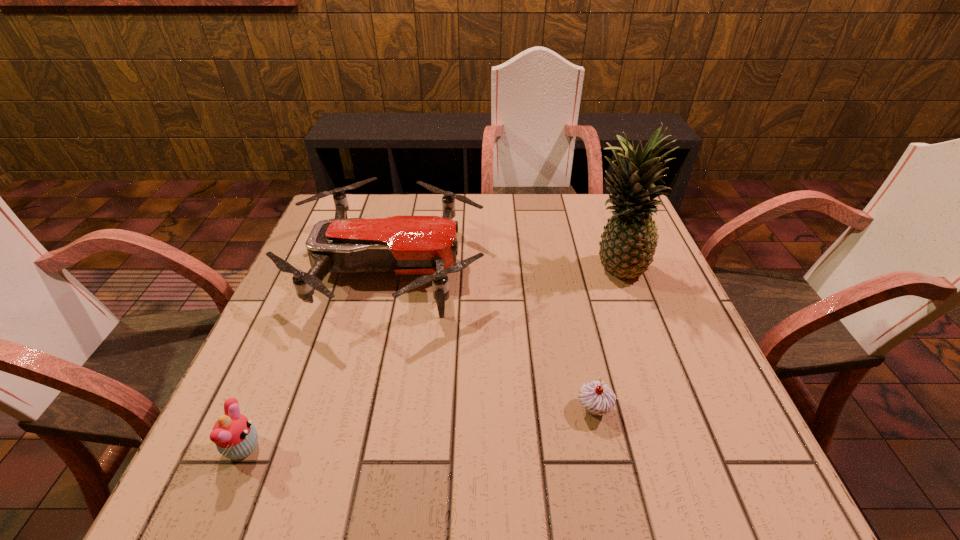
The width and height of the screenshot is (960, 540). I want to click on pineapple, so click(x=628, y=243).

At what (x,y) coordinates should I click in order to perform the action: click on the tallest object. Please return your answer as a coordinate pair (x, y). Looking at the image, I should click on (628, 243).

The height and width of the screenshot is (540, 960). Find the location of `drone`. drone is located at coordinates (403, 245).

Where is `the right cupcake`? the right cupcake is located at coordinates (597, 398).

Locate an element on the screen. This screenshot has height=540, width=960. the left cupcake is located at coordinates (235, 436).

This screenshot has height=540, width=960. I want to click on free space located 0.140m on the front of the rightmost object, so click(x=638, y=330).

This screenshot has width=960, height=540. I want to click on free region located 0.070m on the front-facing side of the drone, so click(x=511, y=267).

The width and height of the screenshot is (960, 540). Identify the location of free space located on the back of the third object from left to right. (584, 363).

Locate an element on the screen. blank space located 0.330m on the face of the left cupcake is located at coordinates (454, 448).

This screenshot has height=540, width=960. Find the location of `object present at the far edge`. object present at the far edge is located at coordinates tap(403, 245).